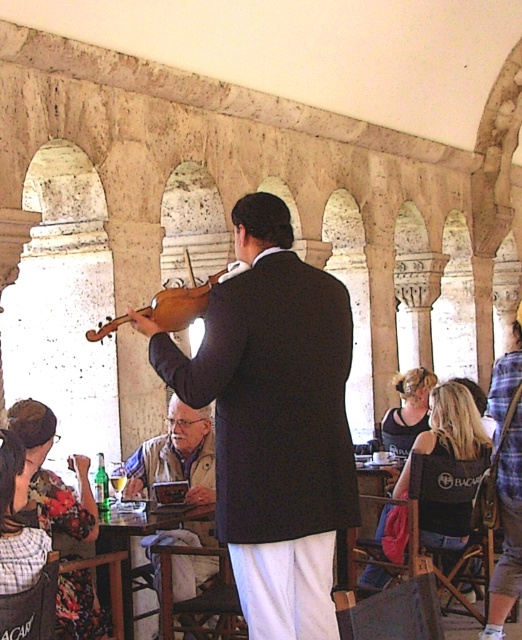
In the scene shown: You are a photographer trying to capture both the dark brown wood violin at center and the wooden violin at center in a single shot. Since you want to highlight the lower one, which violin should you focus on?

The dark brown wood violin at center is below wooden violin at center, so you should focus on the dark brown wood violin at center to highlight the lower one.

You are a photographer planning to capture a closeup shot of the dark brown wood violin at center and the white textured vest at center. Since you want both objects to appear equally prominent in the photo, which object should you zoom in more on and why?

You should zoom in more on the white textured vest at center because it is smaller in size compared to the dark brown wood violin at center. This will help balance their prominence in the photo.